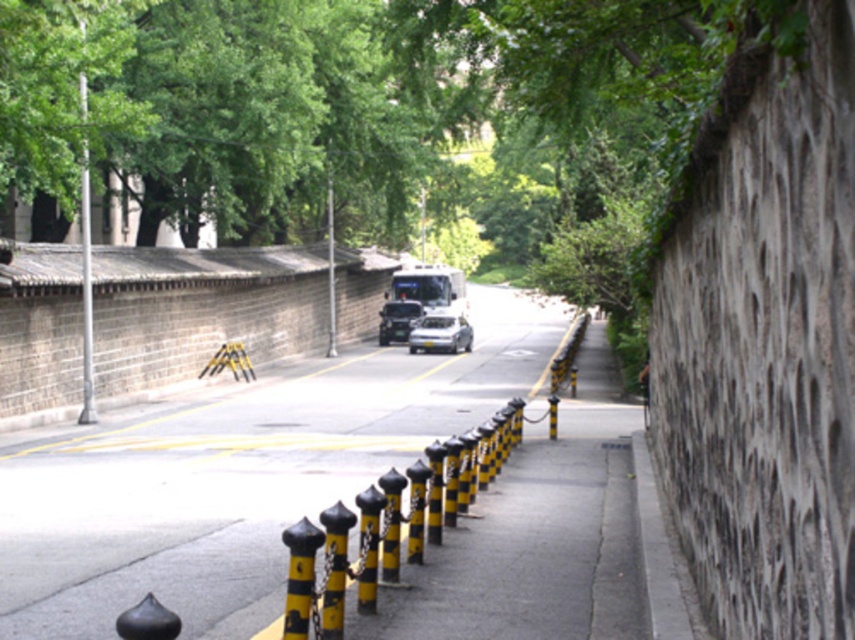
Question: Which object appears closest to the camera in this image?

Choices:
 (A) yellow/black striped barrier at center
 (B) yellow/black striped pole at center
 (C) metallic silver sedan at center

Answer: (A)

Question: Does yellow/black striped bollards at center have a larger size compared to yellow/black striped pole at center?

Choices:
 (A) no
 (B) yes

Answer: (B)

Question: Which object is the closest to the metallic silver sedan at center?

Choices:
 (A) yellow/black striped pole at center
 (B) yellow/black striped barrier at center

Answer: (A)

Question: Which object is the closest to the yellow/black striped bollards at center?

Choices:
 (A) yellow/black striped barrier at center
 (B) metallic silver sedan at center

Answer: (B)

Question: Is yellow/black striped bollards at center to the left of metallic silver sedan at center from the viewer's perspective?

Choices:
 (A) yes
 (B) no

Answer: (A)

Question: Is yellow/black striped bollards at center to the right of silver metallic pole at left from the viewer's perspective?

Choices:
 (A) no
 (B) yes

Answer: (B)